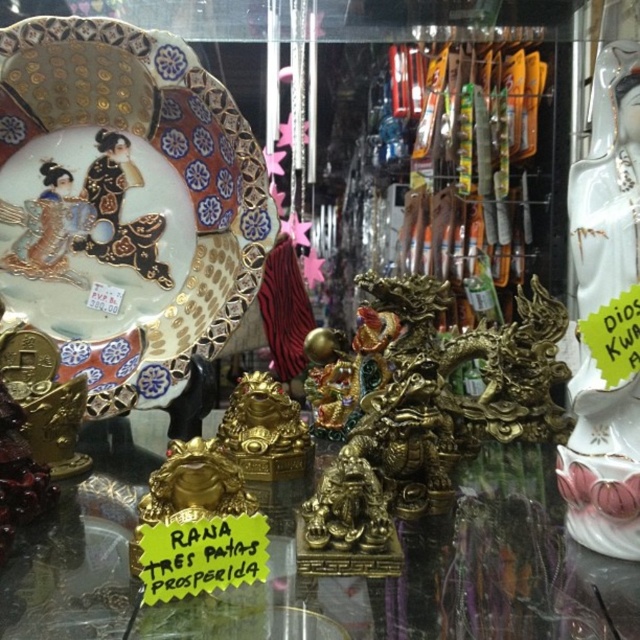
You are standing 1.01 meters away from the point marked at coordinates (x=113, y=477) in the scene. If you want to take a photo of this point with a camera that has a focal length of 50mm, what is the approximate angle of view required to capture the entire scene around that point?

The point marked at coordinates (x=113, y=477) is 1.01 meters away from the camera. To calculate the angle of view needed, you can use the formula for angle of view which is 2 times arctangent of half the sensor size divided by focal length. However, without knowing the sensor size or the dimensions of the scene to capture, it is impossible to determine the exact angle of view required. The question lacks sufficient information about the sensor size or the area to be photographed around the point.

You are a customer in a shop looking at the porcelain painted plate at upper left and the gold metallic statue at center. Which item is located to the right of the other?

The gold metallic statue at center is located to the right of the porcelain painted plate at upper left because the porcelain painted plate at upper left is positioned on the left side of gold metallic statue at center.